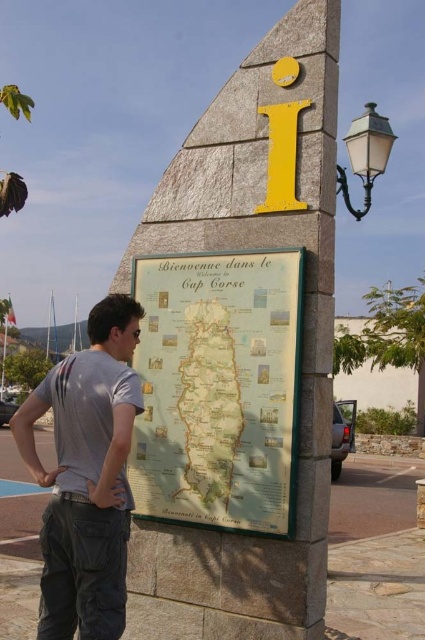
Question: Which of the following is the farthest from the observer?

Choices:
 (A) map at center
 (B) gray cotton t-shirt at center

Answer: (A)

Question: Is map at center wider than gray cotton t-shirt at center?

Choices:
 (A) yes
 (B) no

Answer: (A)

Question: Does map at center come behind gray cotton t-shirt at center?

Choices:
 (A) no
 (B) yes

Answer: (B)

Question: Is map at center bigger than gray cotton t-shirt at center?

Choices:
 (A) yes
 (B) no

Answer: (B)

Question: Which point is farther to the camera?

Choices:
 (A) gray cotton t-shirt at center
 (B) map at center

Answer: (B)